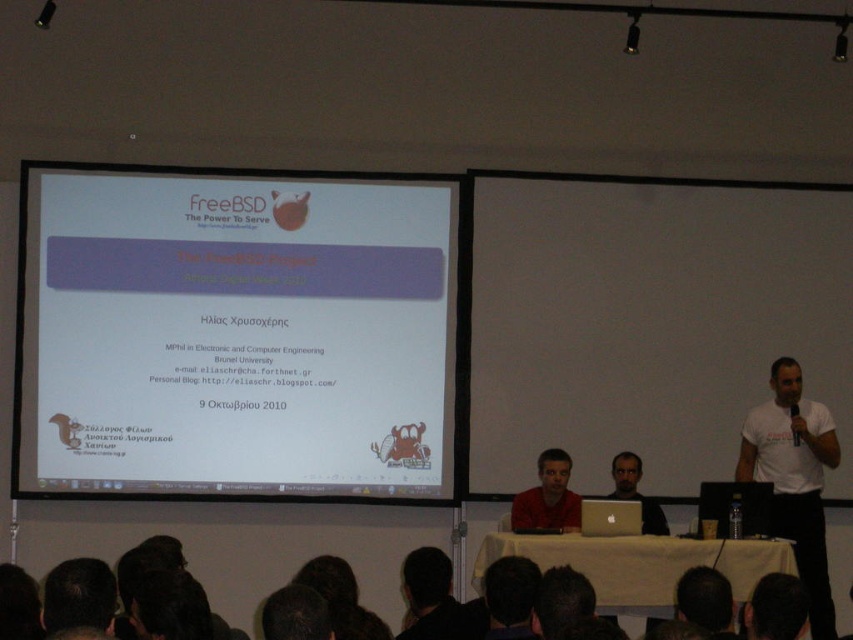
Which is more to the right, white matte projector screen at center or matte red shirt at center?

matte red shirt at center is more to the right.

Between point (172, 477) and point (531, 525), which one is positioned behind?

The point (172, 477) is more distant.

Does point (422, 484) come farther from viewer compared to point (518, 524)?

Yes, point (422, 484) is farther from viewer.

At what (x,y) coordinates should I click in order to perform the action: click on white matte projector screen at center. Please return your answer as a coordinate pair (x, y). Looking at the image, I should click on (234, 333).

Does white t-shirt at right have a lesser height compared to black matte head at lower center?

No, white t-shirt at right is not shorter than black matte head at lower center.

In the scene shown: Who is taller, white t-shirt at right or black matte head at lower center?

white t-shirt at right

Which is behind, point (781, 524) or point (410, 554)?

The point (410, 554) is behind.

Image resolution: width=853 pixels, height=640 pixels. What are the coordinates of `white t-shirt at right` in the screenshot? It's located at (793, 477).

Locate an element on the screen. The image size is (853, 640). white t-shirt at right is located at coordinates (793, 477).

Is point (755, 428) positioned behind point (618, 488)?

No, it is in front of (618, 488).

Locate an element on the screen. white t-shirt at right is located at coordinates (793, 477).